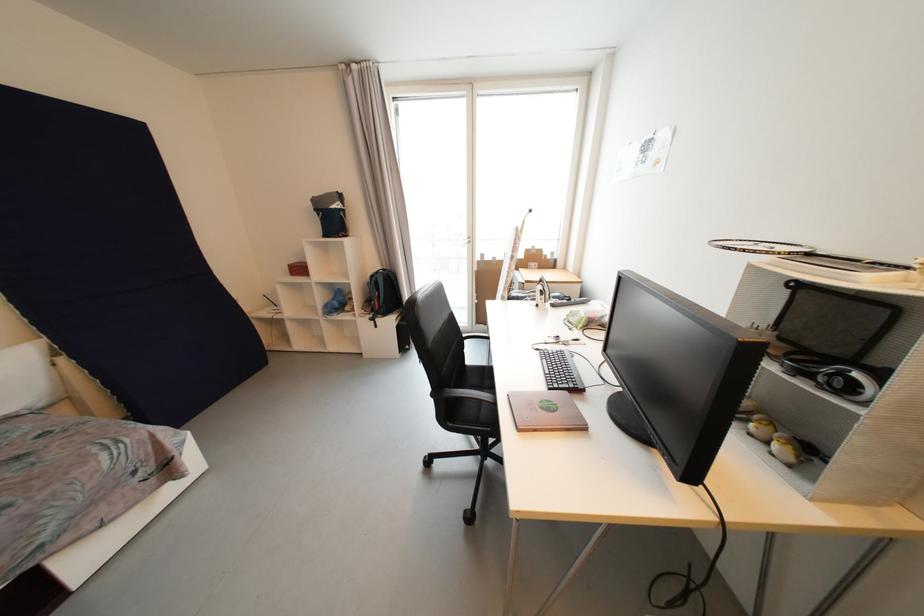
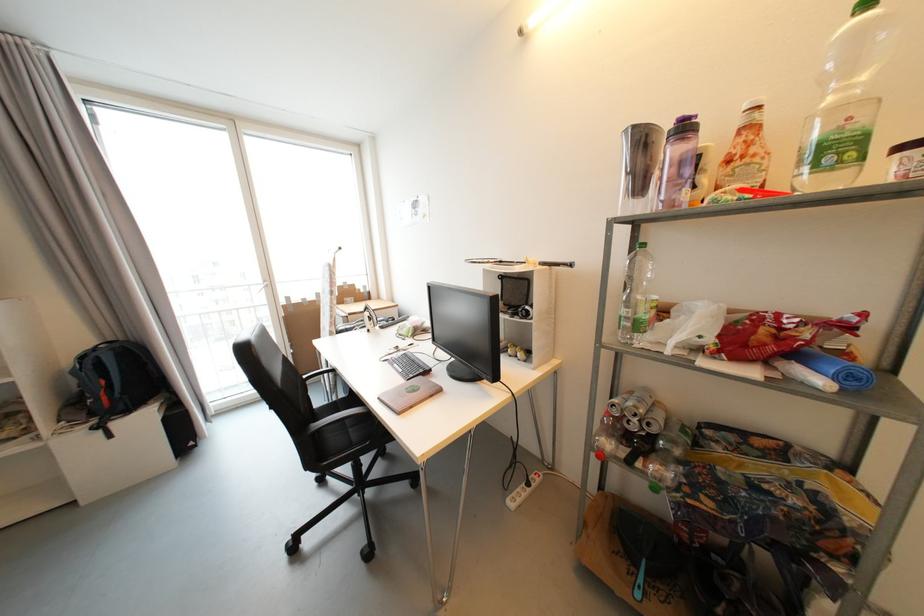
Question: How did the camera likely rotate?

Choices:
 (A) Left
 (B) Right
 (C) Up
 (D) Down

Answer: (B)